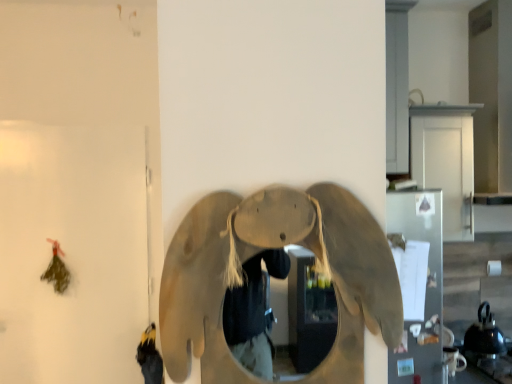
Question: Is matte beige elephant at center not inside metallic silver refrigerator at right?

Choices:
 (A) no
 (B) yes

Answer: (B)

Question: Does matte beige elephant at center appear on the left side of metallic silver refrigerator at right?

Choices:
 (A) no
 (B) yes

Answer: (B)

Question: Is metallic silver refrigerator at right surrounded by matte beige elephant at center?

Choices:
 (A) no
 (B) yes

Answer: (A)

Question: Is matte beige elephant at center taller than metallic silver refrigerator at right?

Choices:
 (A) yes
 (B) no

Answer: (B)

Question: Is matte beige elephant at center in contact with metallic silver refrigerator at right?

Choices:
 (A) yes
 (B) no

Answer: (B)

Question: Is matte beige elephant at center to the right of metallic silver refrigerator at right from the viewer's perspective?

Choices:
 (A) yes
 (B) no

Answer: (B)

Question: Considering the relative positions of metallic silver refrigerator at right and matte beige elephant at center in the image provided, is metallic silver refrigerator at right in front of matte beige elephant at center?

Choices:
 (A) yes
 (B) no

Answer: (B)

Question: From a real-world perspective, does metallic silver refrigerator at right stand above matte beige elephant at center?

Choices:
 (A) no
 (B) yes

Answer: (A)

Question: From the image's perspective, would you say metallic silver refrigerator at right is positioned over matte beige elephant at center?

Choices:
 (A) yes
 (B) no

Answer: (B)

Question: Is metallic silver refrigerator at right smaller than matte beige elephant at center?

Choices:
 (A) yes
 (B) no

Answer: (A)

Question: Are metallic silver refrigerator at right and matte beige elephant at center located far from each other?

Choices:
 (A) yes
 (B) no

Answer: (B)

Question: Would you say metallic silver refrigerator at right is outside matte beige elephant at center?

Choices:
 (A) yes
 (B) no

Answer: (A)

Question: In terms of width, does matte beige elephant at center look wider or thinner when compared to metallic silver refrigerator at right?

Choices:
 (A) wide
 (B) thin

Answer: (A)